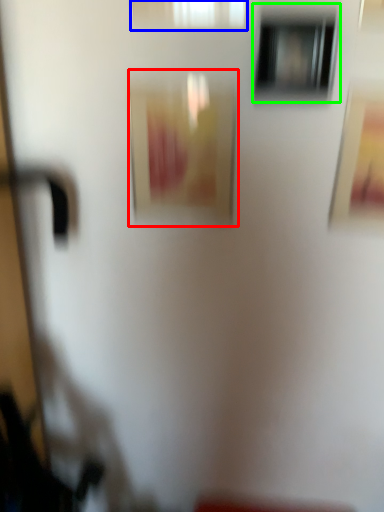
Question: Based on their relative distances, which object is nearer to picture frame (highlighted by a red box)? Choose from window (highlighted by a blue box) and window (highlighted by a green box).

Choices:
 (A) window
 (B) window

Answer: (B)